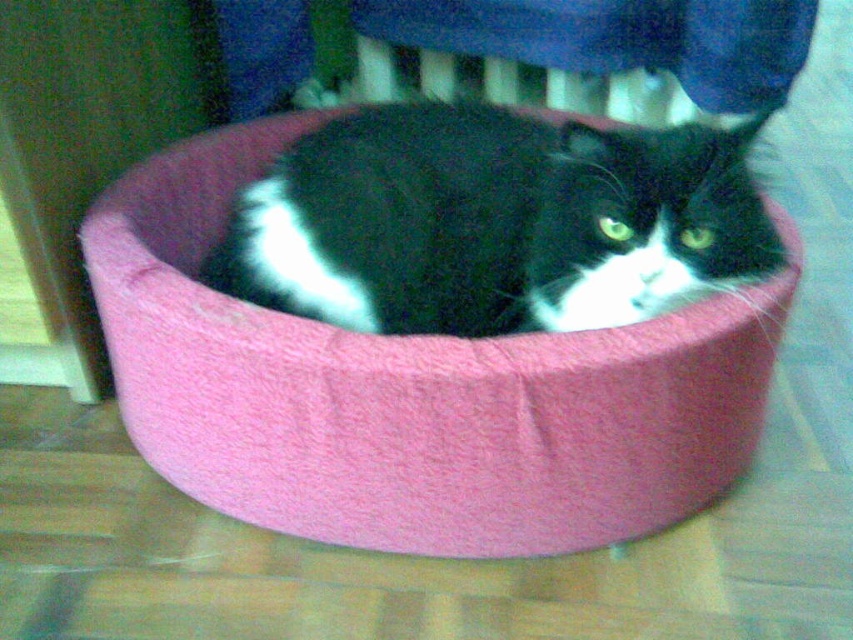
From the picture: Is pink plush cat bed at center above black fuzzy cat at center?

Incorrect, pink plush cat bed at center is not positioned above black fuzzy cat at center.

Who is more forward, (426, 364) or (625, 188)?

Point (426, 364) is in front.

Consider the image. Who is more forward, (460, 353) or (347, 150)?

Point (460, 353) is more forward.

The image size is (853, 640). I want to click on pink plush cat bed at center, so click(410, 392).